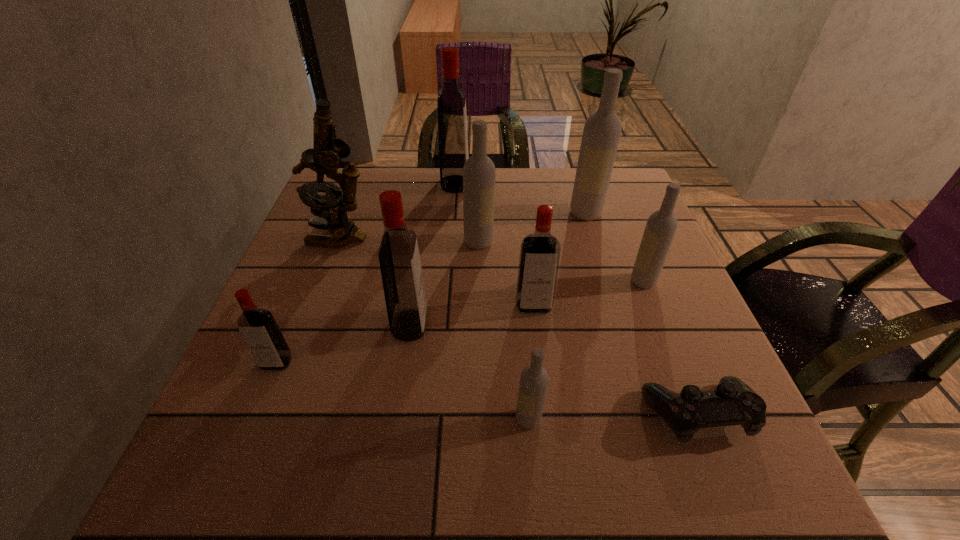
This screenshot has height=540, width=960. I want to click on free spot located on the front and back of the third smallest red vodka, so click(593, 325).

What are the coordinates of `free space located on the back of the sixth nearest object` in the screenshot? It's located at (631, 249).

Find the location of a particular element. This screenshot has height=540, width=960. vacant space positioned on the front and back of the second smallest red vodka is located at coordinates (540, 359).

Find the location of `vacant space situated 0.170m on the front and back of the nearest red vodka`. vacant space situated 0.170m on the front and back of the nearest red vodka is located at coordinates (234, 465).

Image resolution: width=960 pixels, height=540 pixels. Find the location of `free space located 0.330m on the back of the nearest white vodka`. free space located 0.330m on the back of the nearest white vodka is located at coordinates (516, 275).

At what (x,y) coordinates should I click in order to perform the action: click on free region located 0.140m on the left of the shortest object. Please return your answer as a coordinate pair (x, y). Image resolution: width=960 pixels, height=540 pixels. Looking at the image, I should click on (560, 414).

Where is `object at the near edge`? object at the near edge is located at coordinates (732, 402).

This screenshot has width=960, height=540. Identify the location of microscope situated at the left edge. (324, 158).

Identify the location of vodka at the left edge. (258, 327).

This screenshot has width=960, height=540. I want to click on control that is at the right edge, so click(x=732, y=402).